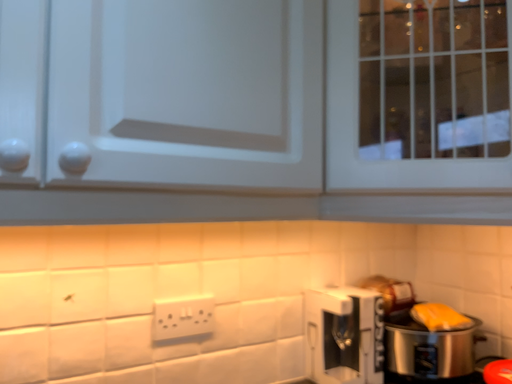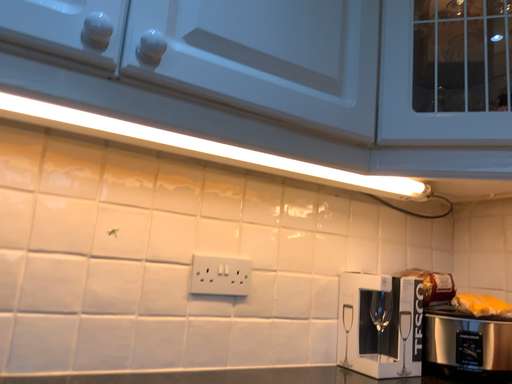
Question: How did the camera likely rotate when shooting the video?

Choices:
 (A) rotated downward
 (B) rotated upward

Answer: (B)